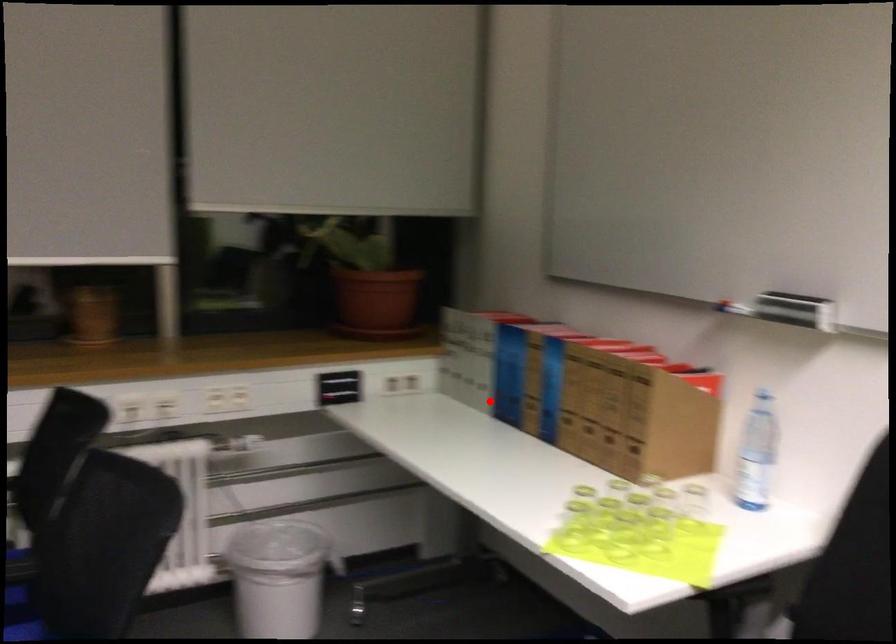
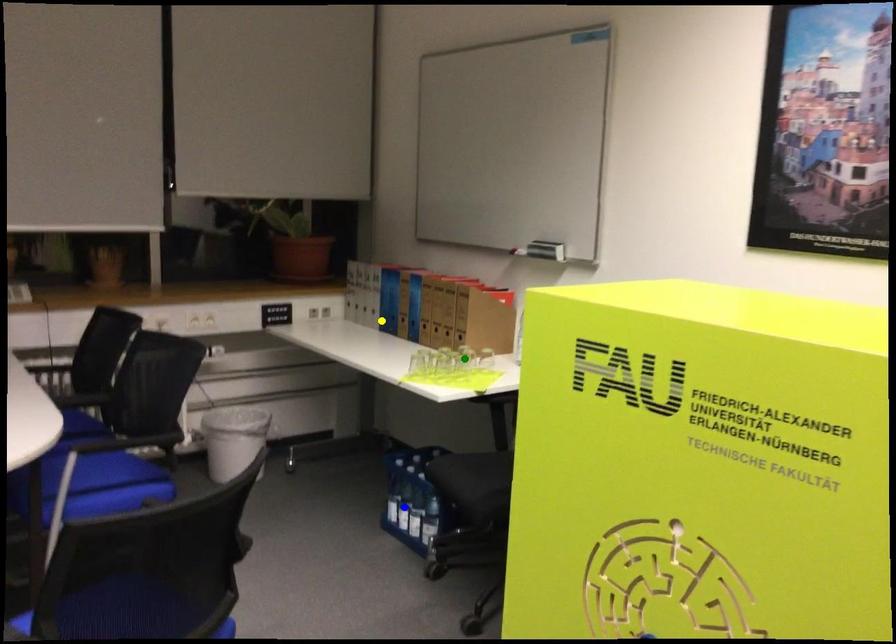
Question: I am providing you with two images of the same scene from different viewpoints. A red point is marked on the first image. You are given multiple points on the second image. Can you choose the point in image 2 that corresponds to the point in image 1?

Choices:
 (A) blue point
 (B) green point
 (C) yellow point

Answer: (C)